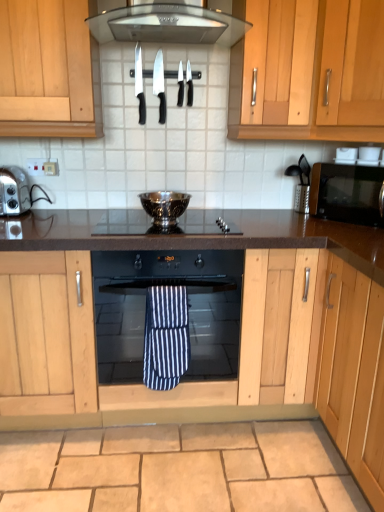
Question: Is polished glass gas stove at center at the right side of metallic black coffee machine at right?

Choices:
 (A) no
 (B) yes

Answer: (A)

Question: Is polished glass gas stove at center touching metallic black coffee machine at right?

Choices:
 (A) yes
 (B) no

Answer: (B)

Question: Is polished glass gas stove at center positioned with its back to metallic black coffee machine at right?

Choices:
 (A) yes
 (B) no

Answer: (B)

Question: Considering the relative sizes of polished glass gas stove at center and metallic black coffee machine at right in the image provided, is polished glass gas stove at center bigger than metallic black coffee machine at right?

Choices:
 (A) no
 (B) yes

Answer: (B)

Question: From the image's perspective, is polished glass gas stove at center over metallic black coffee machine at right?

Choices:
 (A) yes
 (B) no

Answer: (B)

Question: Does polished glass gas stove at center turn towards metallic black coffee machine at right?

Choices:
 (A) no
 (B) yes

Answer: (A)

Question: From a real-world perspective, is silver metallic toaster at left on top of stainless steel range hood at upper center?

Choices:
 (A) no
 (B) yes

Answer: (A)

Question: Considering the relative sizes of silver metallic toaster at left and stainless steel range hood at upper center in the image provided, is silver metallic toaster at left smaller than stainless steel range hood at upper center?

Choices:
 (A) no
 (B) yes

Answer: (B)

Question: Does silver metallic toaster at left have a greater width compared to stainless steel range hood at upper center?

Choices:
 (A) no
 (B) yes

Answer: (A)

Question: From a real-world perspective, does silver metallic toaster at left sit lower than stainless steel range hood at upper center?

Choices:
 (A) yes
 (B) no

Answer: (A)

Question: From the image's perspective, would you say silver metallic toaster at left is shown under stainless steel range hood at upper center?

Choices:
 (A) yes
 (B) no

Answer: (A)

Question: Is silver metallic toaster at left behind stainless steel range hood at upper center?

Choices:
 (A) no
 (B) yes

Answer: (B)

Question: Is black plastic knife at upper center, which is the fourth knife from left to right, to the right of black glossy microwave at right from the viewer's perspective?

Choices:
 (A) yes
 (B) no

Answer: (B)